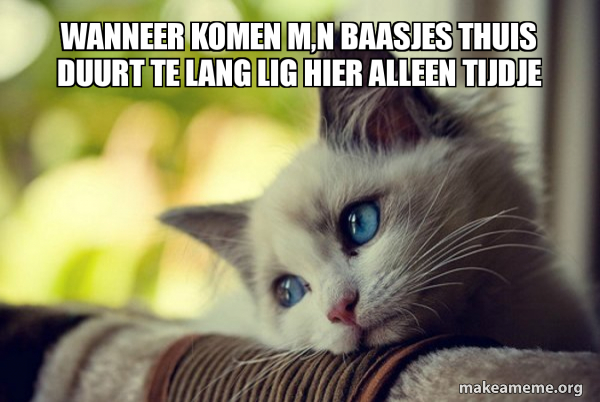
Where is `blanket`? blanket is located at coordinates (346, 387).